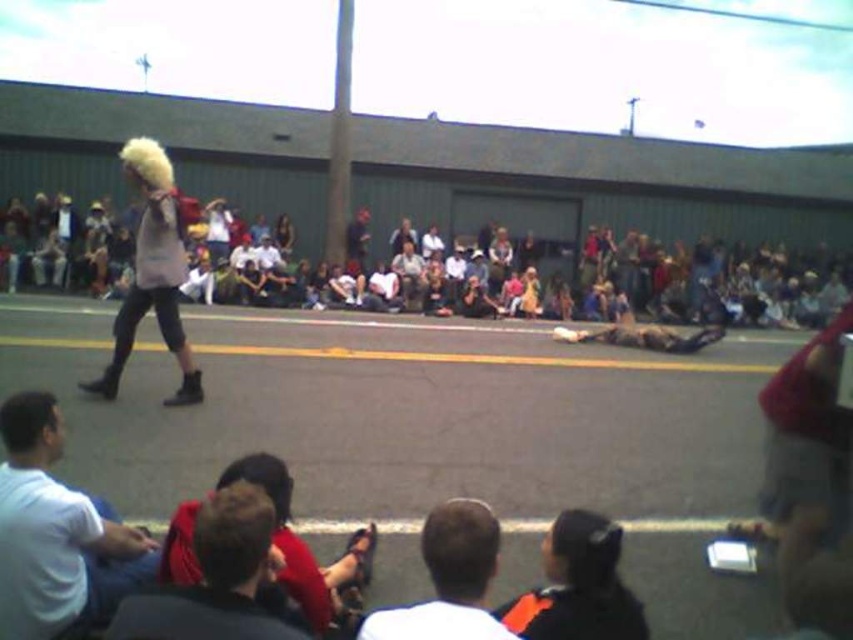
Can you confirm if light brown fabric crowd at center is taller than dark brown leather shoes at lower center?

Yes.

Who is more distant from viewer, (200, 285) or (373, 627)?

Point (200, 285)

Who is more distant from viewer, (62, 250) or (462, 589)?

The point (62, 250) is more distant.

Identify the location of light brown fabric crowd at center. (532, 278).

How distant is light brown fabric crowd at center from fuzzy white wig at left?

11.82 meters

Does point (695, 264) lie behind point (155, 292)?

Yes, point (695, 264) is farther from viewer.

The image size is (853, 640). What do you see at coordinates (532, 278) in the screenshot?
I see `light brown fabric crowd at center` at bounding box center [532, 278].

Where is `light brown fabric crowd at center`? This screenshot has height=640, width=853. light brown fabric crowd at center is located at coordinates (532, 278).

Between orange and black jacket at lower center and dark brown leather shoes at lower center, which one appears on the left side from the viewer's perspective?

Positioned to the left is dark brown leather shoes at lower center.

Looking at this image, does orange and black jacket at lower center have a lesser height compared to dark brown leather shoes at lower center?

Yes, orange and black jacket at lower center is shorter than dark brown leather shoes at lower center.

Who is more distant from viewer, (494, 611) or (456, 624)?

Positioned behind is point (494, 611).

Where is `orange and black jacket at lower center`? orange and black jacket at lower center is located at coordinates (577, 586).